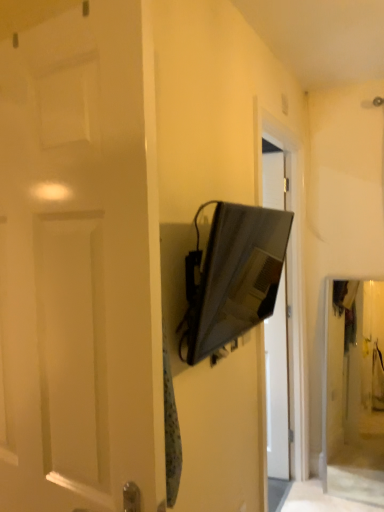
Question: From the image's perspective, is white matte door at left on satin black tv at center?

Choices:
 (A) yes
 (B) no

Answer: (B)

Question: Does white matte door at left have a greater height compared to satin black tv at center?

Choices:
 (A) yes
 (B) no

Answer: (A)

Question: Is white matte door at left far from satin black tv at center?

Choices:
 (A) no
 (B) yes

Answer: (B)

Question: Is white matte door at left to the left of satin black tv at center from the viewer's perspective?

Choices:
 (A) yes
 (B) no

Answer: (A)

Question: Are white matte door at left and satin black tv at center beside each other?

Choices:
 (A) yes
 (B) no

Answer: (B)

Question: Is white matte door at left to the right of satin black tv at center from the viewer's perspective?

Choices:
 (A) yes
 (B) no

Answer: (B)

Question: From the image's perspective, is satin black tv at center above white matte door at left?

Choices:
 (A) no
 (B) yes

Answer: (B)

Question: Would you say satin black tv at center contains white matte door at left?

Choices:
 (A) yes
 (B) no

Answer: (B)

Question: From a real-world perspective, is satin black tv at center beneath white matte door at left?

Choices:
 (A) no
 (B) yes

Answer: (A)

Question: Is satin black tv at center positioned behind white matte door at left?

Choices:
 (A) no
 (B) yes

Answer: (B)

Question: Does satin black tv at center have a greater width compared to white matte door at left?

Choices:
 (A) yes
 (B) no

Answer: (B)

Question: Are satin black tv at center and white matte door at left located far from each other?

Choices:
 (A) yes
 (B) no

Answer: (A)

Question: In terms of width, does satin black tv at center look wider or thinner when compared to white matte door at left?

Choices:
 (A) wide
 (B) thin

Answer: (B)